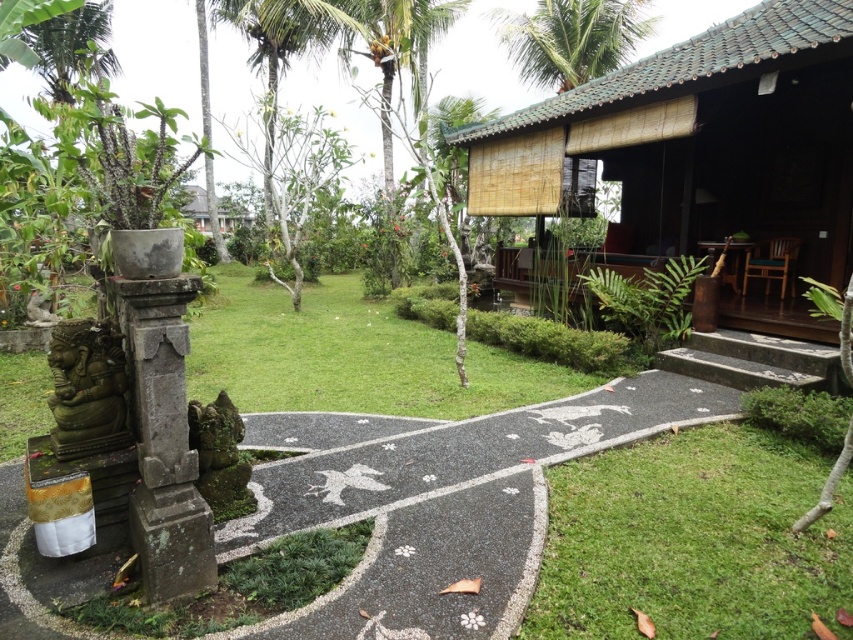
From the picture: You are standing at the entrance of the garden and see two points marked on the pathway. The first point is located at coordinates point (581, 172) and the second point is at point (585, 54). Which point is closer to you as you face the pathway leading towards the building?

Point (581, 172) is in front of point (585, 54), so the first point is closer to you as you face the pathway leading towards the building.

You are a gardener planning to water the green grass at lower right and the green leafy palm tree at upper center. Based on their positions, which one is closer to the left edge of the garden?

The green grass at lower right is positioned on the left side of green leafy palm tree at upper center, so the green grass at lower right is closer to the left edge of the garden.

You are a visitor walking along the pathway and want to take a photo of both the matte bamboo hut at center and the green leafy palm tree at upper center. Which object should you focus on first to ensure both are in the frame?

The matte bamboo hut at center is closer to the viewer than the green leafy palm tree at upper center, so focus on the matte bamboo hut at center first to ensure both are in the frame.